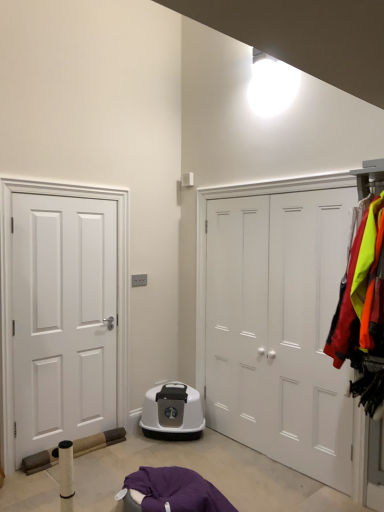
Question: Does reflective nylon jackets at right have a lesser height compared to white matte door at left, positioned as the first door in left-to-right order?

Choices:
 (A) yes
 (B) no

Answer: (A)

Question: Would you say reflective nylon jackets at right is a long distance from white matte door at left, the 2th door in the right-to-left sequence?

Choices:
 (A) yes
 (B) no

Answer: (A)

Question: Can you confirm if reflective nylon jackets at right is positioned to the right of white matte door at left, positioned as the first door in left-to-right order?

Choices:
 (A) no
 (B) yes

Answer: (B)

Question: Considering the relative sizes of reflective nylon jackets at right and white matte door at left, positioned as the first door in left-to-right order, in the image provided, is reflective nylon jackets at right taller than white matte door at left, positioned as the first door in left-to-right order,?

Choices:
 (A) yes
 (B) no

Answer: (B)

Question: Is reflective nylon jackets at right thinner than white matte door at left, positioned as the first door in left-to-right order?

Choices:
 (A) yes
 (B) no

Answer: (B)

Question: Could you tell me if reflective nylon jackets at right is facing white matte door at left, the 2th door in the right-to-left sequence?

Choices:
 (A) no
 (B) yes

Answer: (A)

Question: Can you confirm if reflective nylon jackets at right is wider than white matte door at center, the 1th door from the right?

Choices:
 (A) yes
 (B) no

Answer: (A)

Question: Does reflective nylon jackets at right have a larger size compared to white matte door at center, the 2th door from the left?

Choices:
 (A) no
 (B) yes

Answer: (B)

Question: Is reflective nylon jackets at right in front of white matte door at center, the 2th door from the left?

Choices:
 (A) no
 (B) yes

Answer: (B)

Question: Does reflective nylon jackets at right have a greater height compared to white matte door at center, the 2th door from the left?

Choices:
 (A) yes
 (B) no

Answer: (B)

Question: Are reflective nylon jackets at right and white matte door at center, the 2th door from the left, beside each other?

Choices:
 (A) no
 (B) yes

Answer: (A)

Question: From a real-world perspective, is reflective nylon jackets at right positioned under white matte door at center, the 1th door from the right, based on gravity?

Choices:
 (A) no
 (B) yes

Answer: (A)

Question: From a real-world perspective, is white matte door at left, positioned as the first door in left-to-right order, on top of white matte door at center, the 2th door from the left?

Choices:
 (A) no
 (B) yes

Answer: (A)